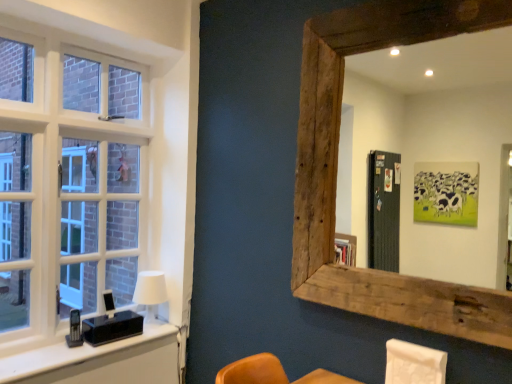
This screenshot has width=512, height=384. I want to click on white matte table lamp at left, so click(150, 292).

In order to face white wood window at left, should I rotate leftwards or rightwards?

It's best to rotate left around 22.117 degrees.

What is the approximate height of rustic wood mirror at upper right?

rustic wood mirror at upper right is 1.21 meters tall.

Find the location of `black plastic vanity at left`. black plastic vanity at left is located at coordinates (100, 361).

From a real-world perspective, who is located higher, white wood window at left or white fabric swivel chair at lower right?

In real-world perspective, white wood window at left is above.

Find the location of a particular element. Image resolution: width=512 pixels, height=384 pixels. window to the left of white fabric swivel chair at lower right is located at coordinates (x=67, y=183).

Is white wood window at left facing towards white fabric swivel chair at lower right?

Yes.

Is white wood window at left outside of white fabric swivel chair at lower right?

A: white wood window at left lies outside white fabric swivel chair at lower right's area.

Does white fabric swivel chair at lower right turn towards black plastic vanity at left?

No, white fabric swivel chair at lower right is not turned towards black plastic vanity at left.

This screenshot has width=512, height=384. Find the location of `vanity behind the white fabric swivel chair at lower right`. vanity behind the white fabric swivel chair at lower right is located at coordinates (100, 361).

Looking at this image, which is more to the right, white fabric swivel chair at lower right or black plastic vanity at left?

white fabric swivel chair at lower right.

Which is in front, rustic wood mirror at upper right or black plastic vanity at left?

rustic wood mirror at upper right is more forward.

Considering the positions of point (356, 80) and point (17, 377), is point (356, 80) closer or farther from the camera than point (17, 377)?

Point (356, 80) appears to be farther away from the viewer than point (17, 377).

From the image's perspective, who appears lower, rustic wood mirror at upper right or black plastic vanity at left?

black plastic vanity at left is shown below in the image.

Is white matte table lamp at left positioned with its back to rustic wood mirror at upper right?

No, white matte table lamp at left is not facing the opposite direction of rustic wood mirror at upper right.

Would you say white matte table lamp at left is inside or outside rustic wood mirror at upper right?

white matte table lamp at left is not inside rustic wood mirror at upper right, it's outside.

Considering the sizes of objects white matte table lamp at left and rustic wood mirror at upper right in the image provided, who is bigger, white matte table lamp at left or rustic wood mirror at upper right?

With larger size is rustic wood mirror at upper right.

Are white matte table lamp at left and rustic wood mirror at upper right far apart?

Yes, white matte table lamp at left is far from rustic wood mirror at upper right.

From their relative heights in the image, would you say rustic wood mirror at upper right is taller or shorter than white matte table lamp at left?

Clearly, rustic wood mirror at upper right is taller compared to white matte table lamp at left.

Is rustic wood mirror at upper right facing towards white matte table lamp at left?

No, rustic wood mirror at upper right is not facing towards white matte table lamp at left.

Based on the photo, which of these two, rustic wood mirror at upper right or white matte table lamp at left, is wider?

white matte table lamp at left.

From the image's perspective, between white wood window at left and white matte table lamp at left, who is located below?

white matte table lamp at left appears lower in the image.

Is point (42, 135) behind point (139, 273)?

No.

Between white wood window at left and white matte table lamp at left, which one has smaller width?

white wood window at left is thinner.

Based on the photo, considering the relative positions of white wood window at left and white matte table lamp at left in the image provided, is white wood window at left behind white matte table lamp at left?

No, white wood window at left is in front of white matte table lamp at left.

In the scene shown: Who is bigger, white fabric swivel chair at lower right or white matte table lamp at left?

white matte table lamp at left is bigger.

Which point is more distant from viewer, (414, 376) or (144, 272)?

The point (144, 272) is farther from the camera.

I want to click on table lamp positioned vertically above the white fabric swivel chair at lower right (from a real-world perspective), so click(x=150, y=292).

Locate an element on the screen. Image resolution: width=512 pixels, height=384 pixels. swivel chair that is below the white wood window at left (from the image's perspective) is located at coordinates (414, 364).

Where is `vanity that appears behind the white fabric swivel chair at lower right`? This screenshot has width=512, height=384. vanity that appears behind the white fabric swivel chair at lower right is located at coordinates (100, 361).

Considering their positions, is white matte table lamp at left positioned further to white wood window at left than white fabric swivel chair at lower right?

white fabric swivel chair at lower right.

Estimate the real-world distances between objects in this image. Which object is further from white matte table lamp at left, white wood window at left or black plastic vanity at left?

Among the two, white wood window at left is located further to white matte table lamp at left.

From the image, which object appears to be nearer to white matte table lamp at left, white wood window at left or rustic wood mirror at upper right?

Based on the image, white wood window at left appears to be nearer to white matte table lamp at left.

Estimate the real-world distances between objects in this image. Which object is closer to white matte table lamp at left, white fabric swivel chair at lower right or rustic wood mirror at upper right?

white fabric swivel chair at lower right is closer to white matte table lamp at left.

Looking at the image, which one is located closer to white wood window at left, rustic wood mirror at upper right or black plastic vanity at left?

black plastic vanity at left is closer to white wood window at left.

From the image, which object appears to be farther from black plastic vanity at left, white fabric swivel chair at lower right or rustic wood mirror at upper right?

Among the two, rustic wood mirror at upper right is located further to black plastic vanity at left.

Based on their spatial positions, is black plastic vanity at left or white matte table lamp at left closer to rustic wood mirror at upper right?

white matte table lamp at left lies closer to rustic wood mirror at upper right than the other object.

Based on their spatial positions, is white matte table lamp at left or rustic wood mirror at upper right closer to white wood window at left?

white matte table lamp at left.

Where is `vanity between white wood window at left and rustic wood mirror at upper right`? The height and width of the screenshot is (384, 512). vanity between white wood window at left and rustic wood mirror at upper right is located at coordinates (100, 361).

I want to click on table lamp between white wood window at left and black plastic vanity at left in the up-down direction, so click(x=150, y=292).

What are the coordinates of `table lamp located between white wood window at left and rustic wood mirror at upper right in the left-right direction` in the screenshot? It's located at (150, 292).

Identify the location of mirror between white matte table lamp at left and white fabric swivel chair at lower right in the horizontal direction. (432, 143).